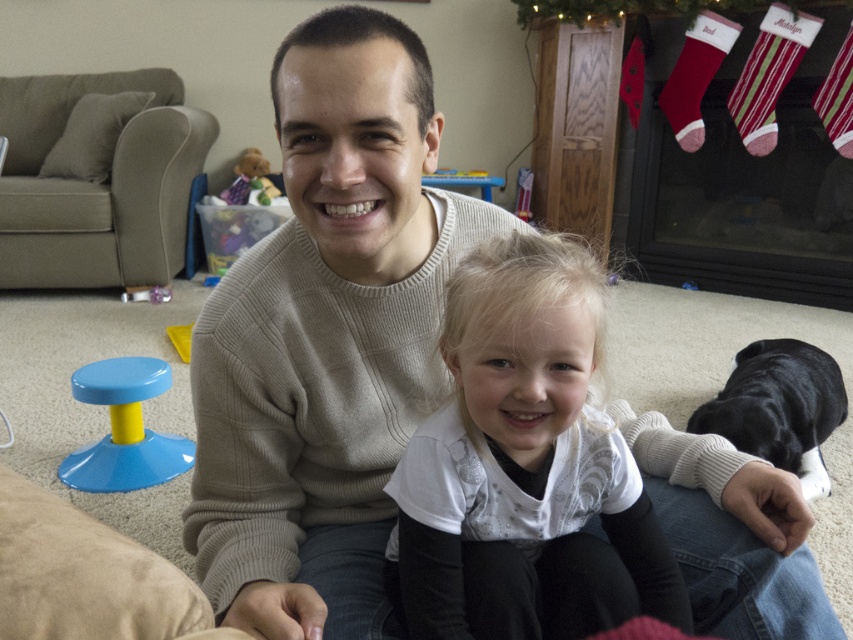
Question: Can you confirm if white matte shirt at center is bigger than black smooth dog at lower right?

Choices:
 (A) no
 (B) yes

Answer: (A)

Question: Can you confirm if blue plastic stool at lower left is positioned to the left of velvet red stocking at upper right?

Choices:
 (A) no
 (B) yes

Answer: (B)

Question: Where is blue plastic stool at lower left located in relation to green striped sock at upper right in the image?

Choices:
 (A) left
 (B) right

Answer: (A)

Question: Which point is closer to the camera taking this photo?

Choices:
 (A) (703, 412)
 (B) (254, 164)
 (C) (756, 61)

Answer: (A)

Question: Which of the following is the farthest from the observer?

Choices:
 (A) white matte shirt at center
 (B) fuzzy fabric teddy bear at upper left
 (C) striped cotton sock at upper right
 (D) velvet red stocking at upper right

Answer: (B)

Question: Among these objects, which one is farthest from the camera?

Choices:
 (A) striped cotton sock at upper right
 (B) green striped sock at upper right
 (C) white matte shirt at center
 (D) velvet red stocking at upper right

Answer: (D)